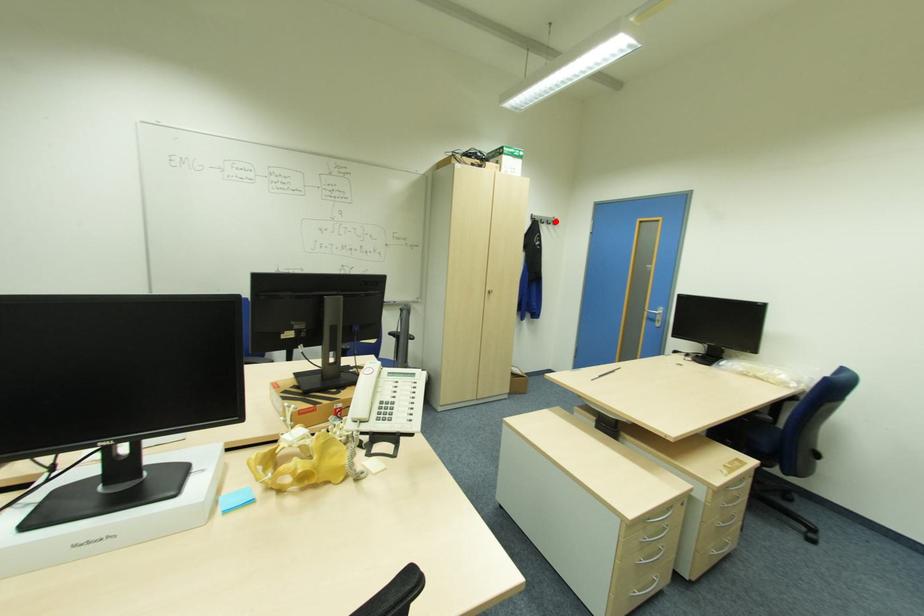
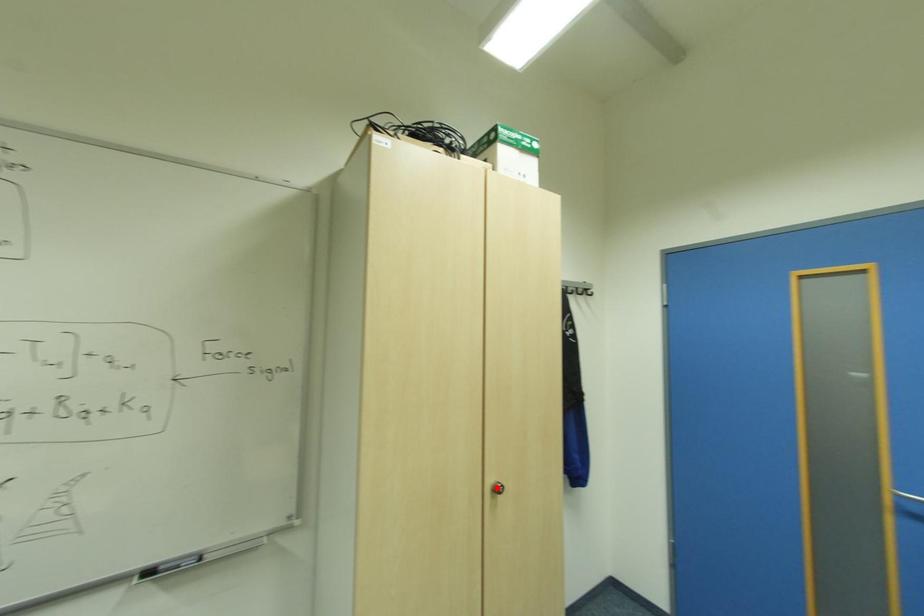
I am providing you with two images of the same scene from different viewpoints. A red point is marked on the first image and another point is marked on the second image. Is the marked point in image1 the same physical position as the marked point in image2?

No